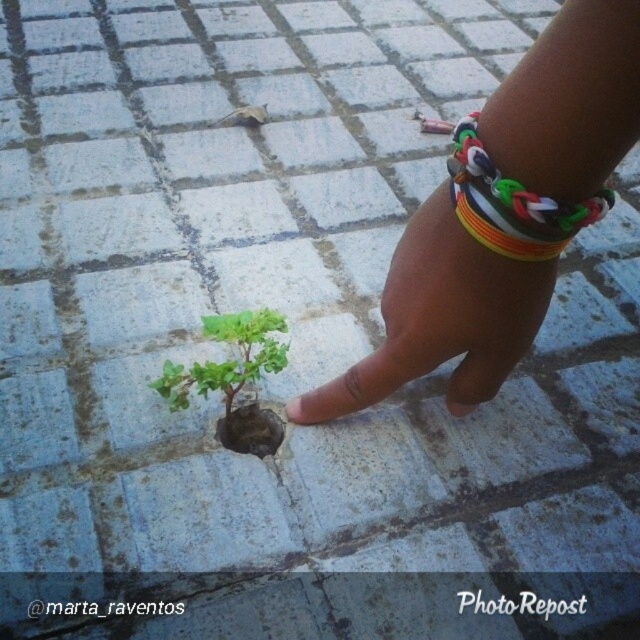
Which is behind, point (477, 368) or point (516, 257)?

Point (477, 368)

Between multicolored rubber band at center and rainbow plastic bracelet at upper right, which one has more height?

With more height is multicolored rubber band at center.

Is point (481, 352) less distant than point (474, 163)?

No, it is behind (474, 163).

Where is `multicolored rubber band at center`? The height and width of the screenshot is (640, 640). multicolored rubber band at center is located at coordinates (442, 317).

How far apart are multicolored rubber band at center and green matte plant at center?

multicolored rubber band at center is 7.38 inches away from green matte plant at center.

Is multicolored rubber band at center behind green matte plant at center?

No, it is in front of green matte plant at center.

Is point (410, 230) more distant than point (205, 332)?

No, it is in front of (205, 332).

You are a GUI agent. You are given a task and a screenshot of the screen. Output one action in this format:
    pyautogui.click(x=<x>, y=<y>)
    Task: Click on the multicolored rubber band at center
    The height and width of the screenshot is (640, 640).
    Given the screenshot: What is the action you would take?
    pyautogui.click(x=442, y=317)

Which is in front, point (540, 179) or point (380, 300)?

Positioned in front is point (540, 179).

Does rainbow rubber band at center have a smaller size compared to multicolored rubber band at center?

No, rainbow rubber band at center is not smaller than multicolored rubber band at center.

Describe the element at coordinates (502, 216) in the screenshot. I see `rainbow rubber band at center` at that location.

Identify the location of rainbow rubber band at center. This screenshot has width=640, height=640. (502, 216).